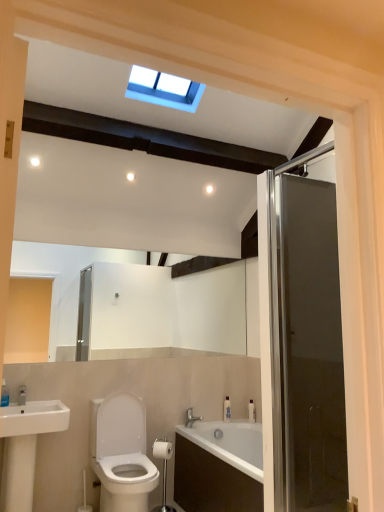
Identify the location of free space in front of silver metallic faucet at lower center. (199, 430).